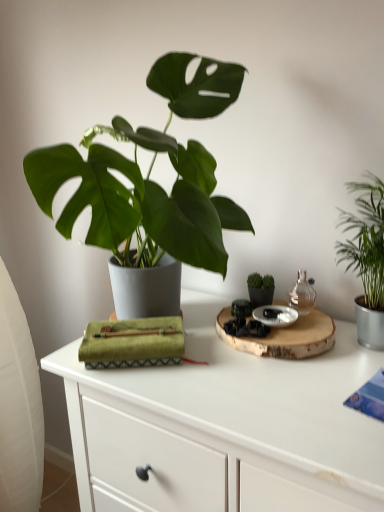
Where is `free space to the left of transparent glass bottle at upper right`? This screenshot has width=384, height=512. free space to the left of transparent glass bottle at upper right is located at coordinates (206, 333).